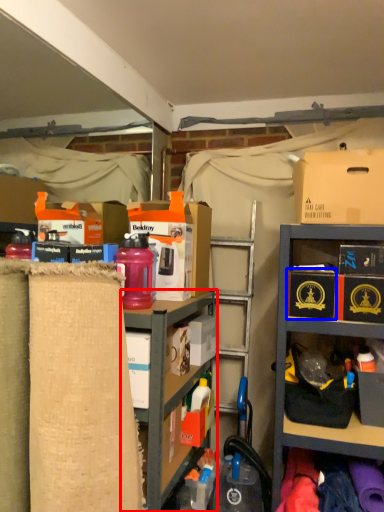
Question: Among these objects, which one is farthest to the camera, shelf (highlighted by a red box) or storage box (highlighted by a blue box)?

Choices:
 (A) shelf
 (B) storage box

Answer: (B)